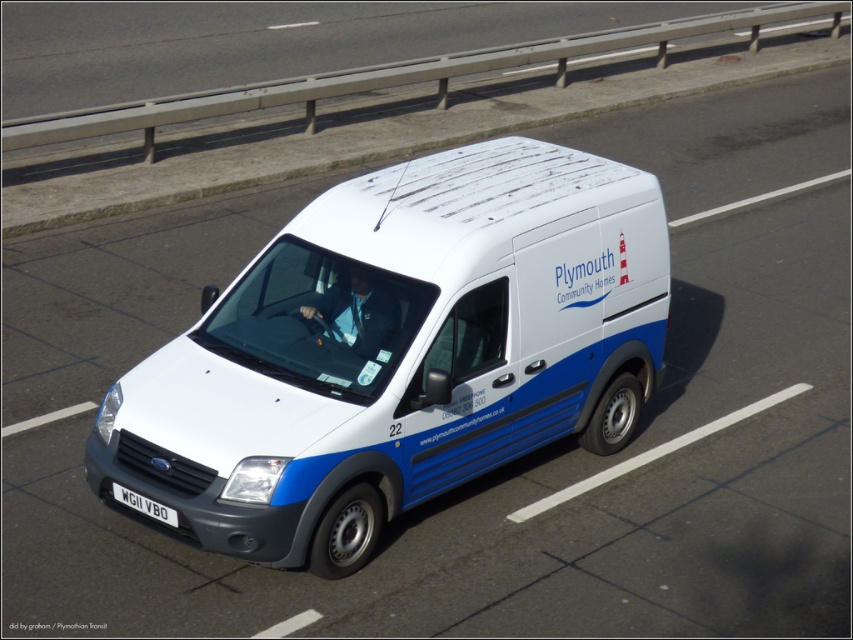
Can you confirm if white matte van at center is bigger than white plastic license plate at lower center?

Yes, white matte van at center is bigger than white plastic license plate at lower center.

Who is taller, white matte van at center or white plastic license plate at lower center?

white matte van at center is taller.

The height and width of the screenshot is (640, 853). I want to click on white matte van at center, so click(x=397, y=353).